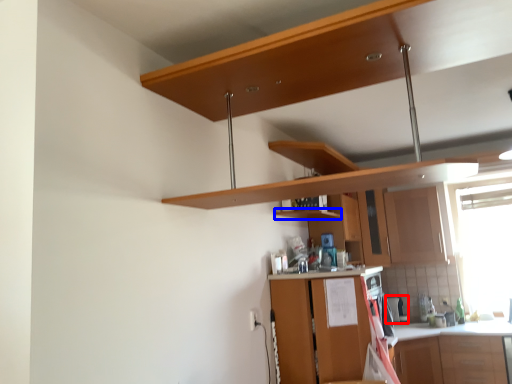
Question: Which object appears closest to the camera in this image, appliance (highlighted by a red box) or shelf (highlighted by a blue box)?

Choices:
 (A) appliance
 (B) shelf

Answer: (B)